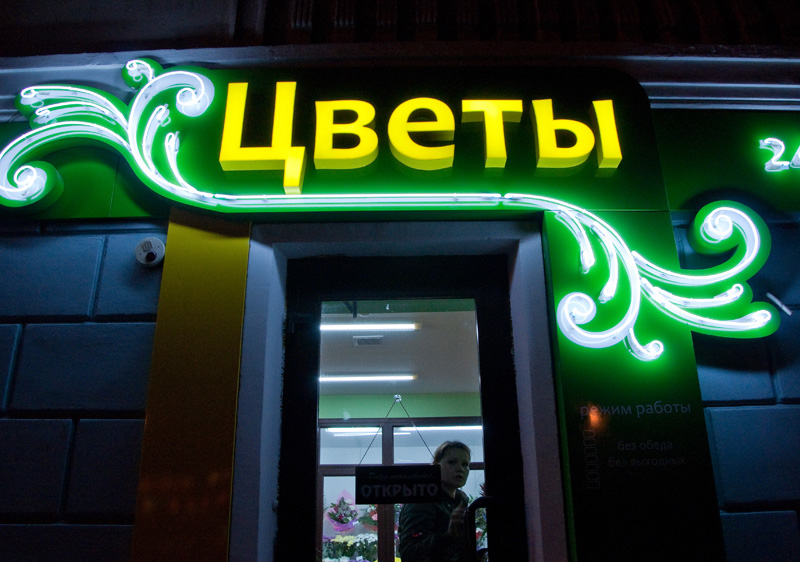
Find the location of a particular element. Image resolution: width=800 pixels, height=562 pixels. yellow border around doorway is located at coordinates (196, 391).